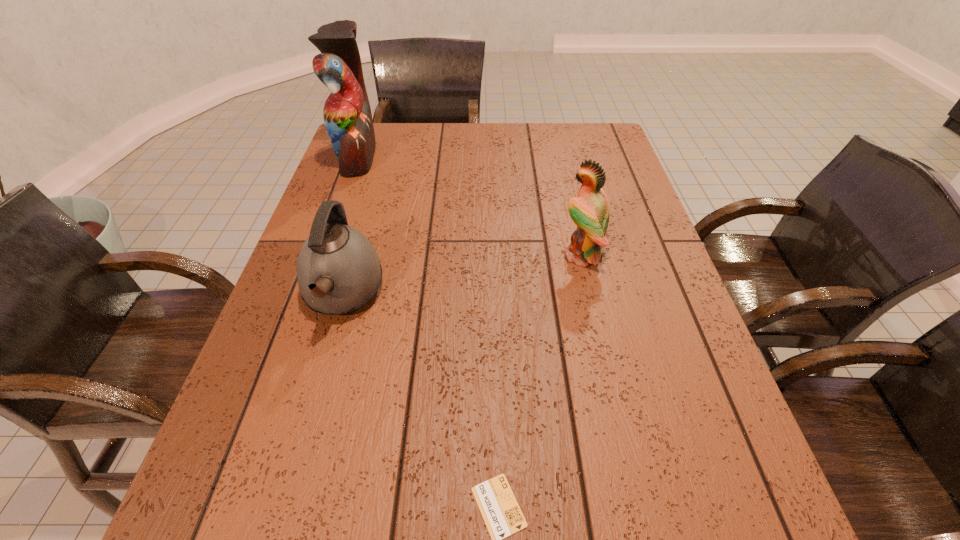
The image size is (960, 540). Identify the location of the farthest object. (347, 115).

Identify the location of the farther parrot. The height and width of the screenshot is (540, 960). (347, 115).

This screenshot has height=540, width=960. What are the coordinates of `the rightmost object` in the screenshot? It's located at point(589,211).

What are the coordinates of `the second tallest object` in the screenshot? It's located at (589, 211).

Locate an element on the screen. The image size is (960, 540). the second shortest object is located at coordinates (338, 270).

Find the location of a particular element. The height and width of the screenshot is (540, 960). vacant space located at the face of the left parrot is located at coordinates (431, 156).

Identify the location of free region located 0.250m on the front-facing side of the third shortest object. click(457, 255).

You are a GUI agent. You are given a task and a screenshot of the screen. Output one action in this format:
    pyautogui.click(x=<x>, y=<y>)
    Task: Click on the vacant region located on the front-facing side of the third shortest object
    The width and height of the screenshot is (960, 540).
    Given the screenshot: What is the action you would take?
    pyautogui.click(x=457, y=255)

This screenshot has height=540, width=960. What are the coordinates of `vacant point located 0.090m on the front-facing side of the third shortest object` in the screenshot? It's located at (523, 255).

I want to click on free spot located 0.050m at the spout of the second shortest object, so click(324, 360).